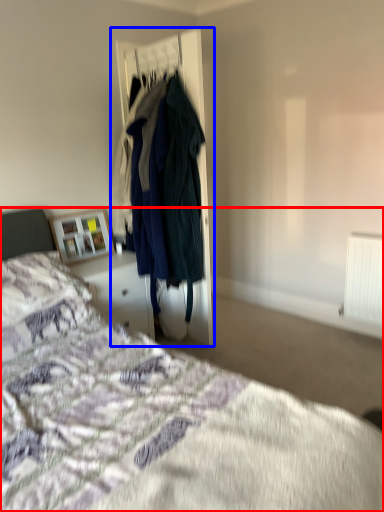
Question: Which object is further to the camera taking this photo, bed (highlighted by a red box) or closet (highlighted by a blue box)?

Choices:
 (A) bed
 (B) closet

Answer: (B)